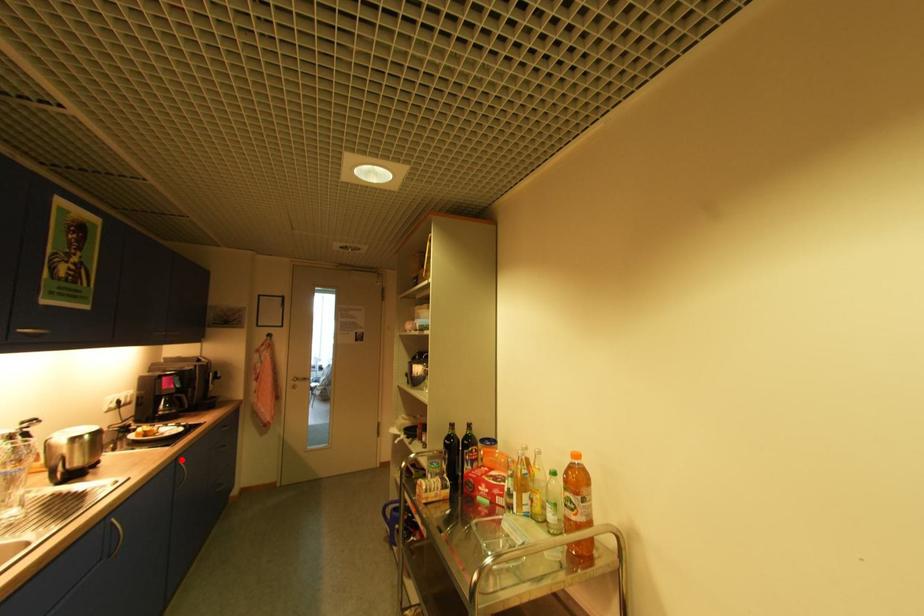
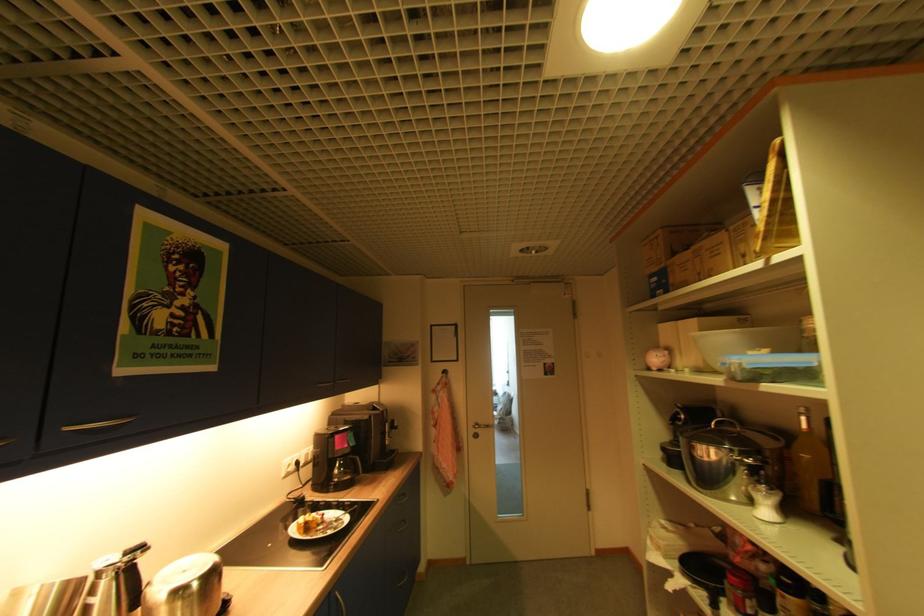
Find the pixel in the second image that matches the highlighted location in the first image.

(335, 593)